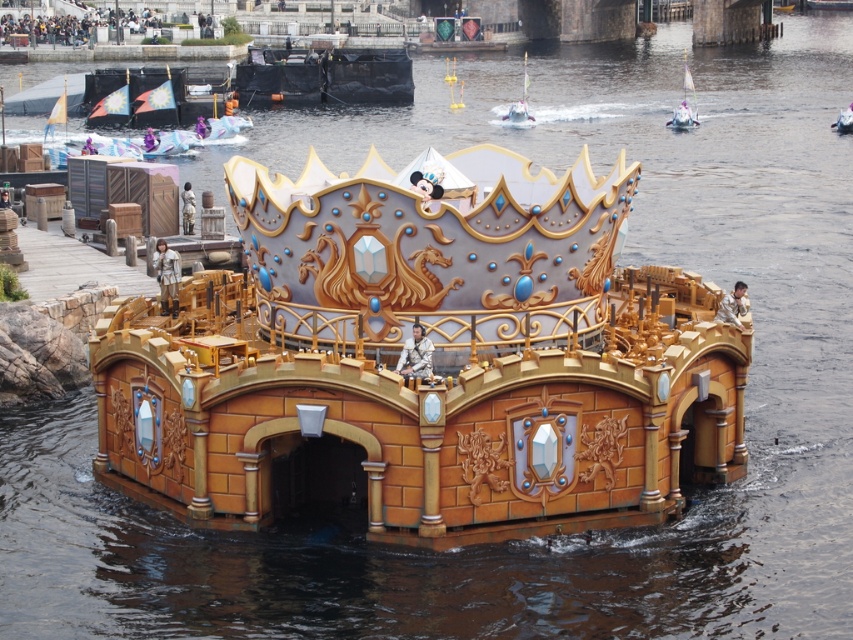
Question: Which of the following is the farthest from the observer?

Choices:
 (A) (677, 122)
 (B) (521, 115)

Answer: (B)

Question: Does white glossy sailboat at upper right appear under metallic silver boat at center?

Choices:
 (A) yes
 (B) no

Answer: (B)

Question: Is metallic silver sailboat at upper center closer to the viewer compared to metallic silver boat at center?

Choices:
 (A) yes
 (B) no

Answer: (B)

Question: Is white glossy sailboat at upper right above metallic silver sailboat at upper center?

Choices:
 (A) yes
 (B) no

Answer: (A)

Question: Which point is farther to the camera?

Choices:
 (A) metallic silver sailboat at upper center
 (B) metallic silver boat at center

Answer: (A)

Question: Which of these objects is positioned farthest from the metallic silver boat at center?

Choices:
 (A) metallic silver sailboat at upper center
 (B) white glossy sailboat at upper right

Answer: (A)